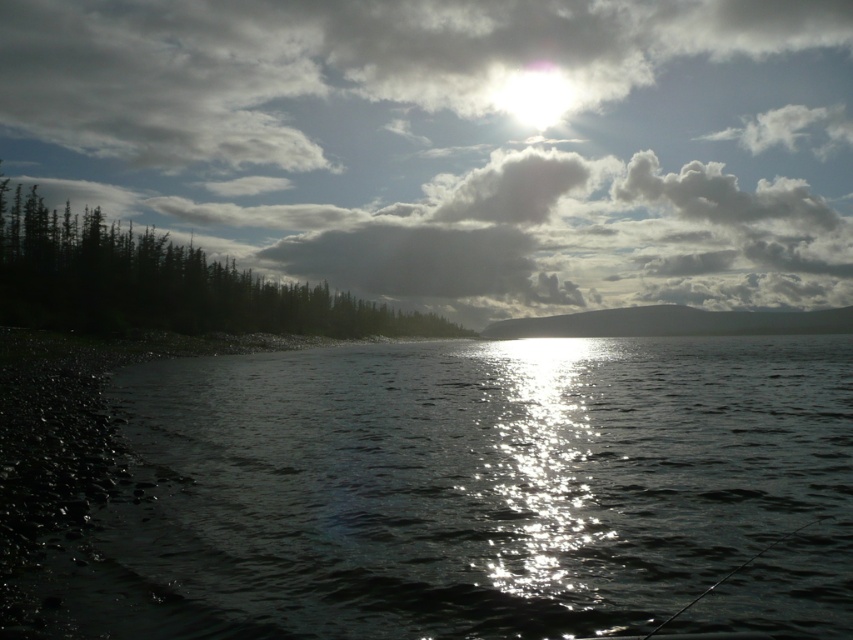
You are standing at the lakeside and want to walk towards the green matte trees at left. Which direction should you move to get closer to them without crossing the glistening water at center?

You should move to the left side away from the glistening water at center because the green matte trees at left are farther from the viewer, so moving left would bring you closer to them while avoiding the water.

You are standing at the edge of the lake and want to locate the glistening water at center. According to the coordinates provided, where exactly should you look relative to your position?

The glistening water at center is located at coordinates point 0.766 on the x axis and 0.504 on the y axis relative to your position.